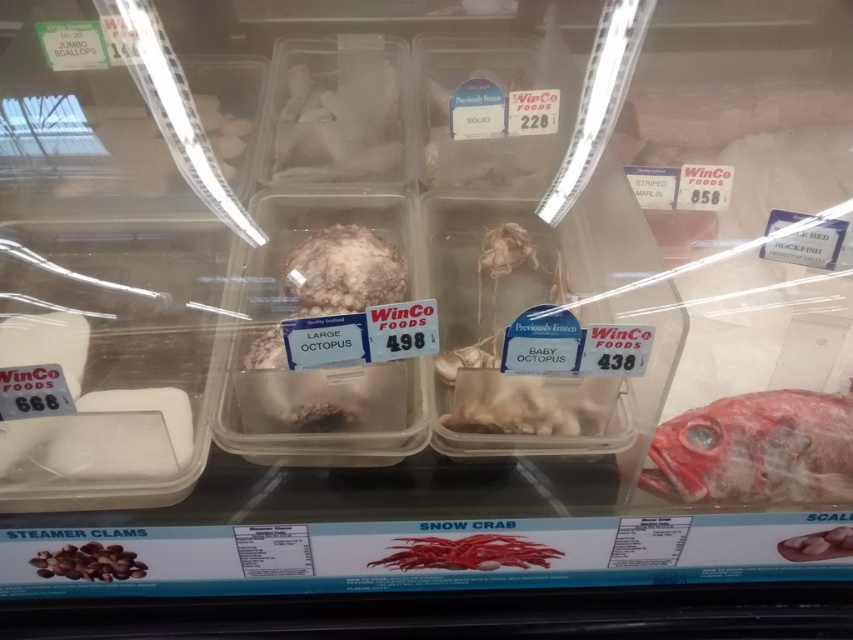
You are a customer at WinCo Foods looking at the seafood display. You see the white frosted octopus at center and the brown matte clams at lower left. Which container is taller?

The white frosted octopus at center is taller than the brown matte clams at lower left.

You are a customer at WinCo Foods looking at the seafood display case. You see the white matte octopus at center and the white matte scallops at lower right. Which of these two items is located to the left of the other?

The white matte octopus at center is positioned on the left side of white matte scallops at lower right.